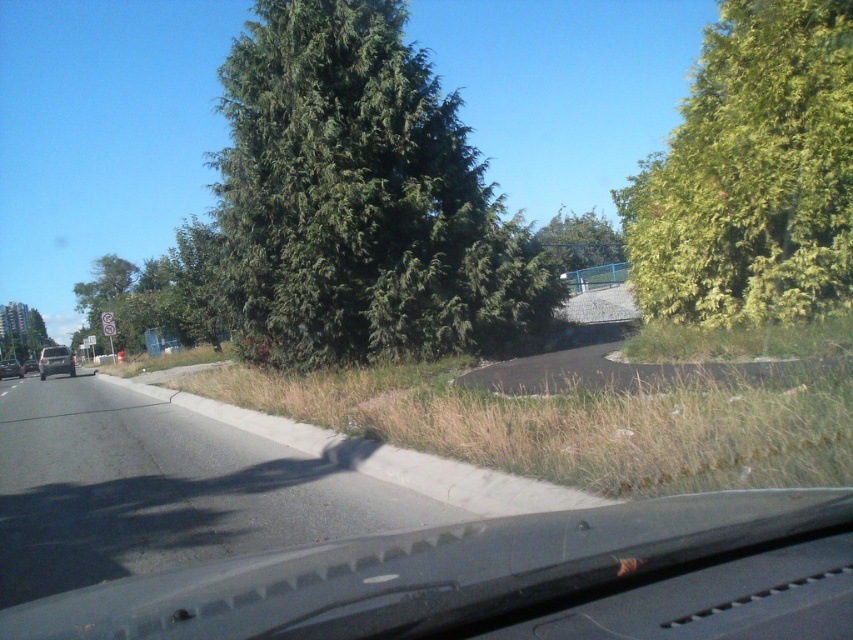
How much distance is there between green leafy tree at left and silver metallic van at left?

They are 15.56 meters apart.

Is green leafy tree at left above silver metallic van at left?

Yes.

Between point (163, 259) and point (54, 372), which one is positioned behind?

Positioned behind is point (163, 259).

Where is `green leafy tree at left`? green leafy tree at left is located at coordinates (161, 291).

Does green leafy tree at center appear over green leafy tree at upper right?

Indeed, green leafy tree at center is positioned over green leafy tree at upper right.

Between point (440, 116) and point (729, 17), which one is positioned behind?

Point (440, 116)

Where is `green leafy tree at center`? green leafy tree at center is located at coordinates (360, 198).

Between point (514, 221) and point (24, 371), which one is positioned behind?

Point (24, 371)

Between green leafy tree at center and matte silver sedan at left, which one appears on the left side from the viewer's perspective?

From the viewer's perspective, matte silver sedan at left appears more on the left side.

This screenshot has width=853, height=640. What are the coordinates of `green leafy tree at center` in the screenshot? It's located at (360, 198).